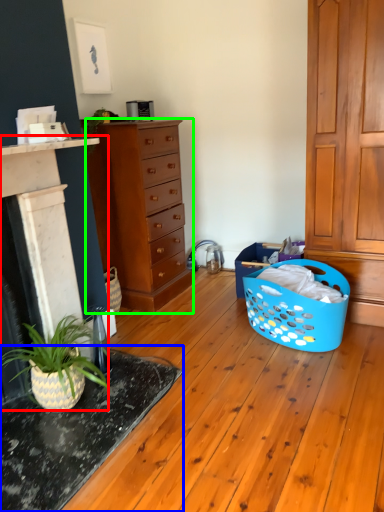
Question: Estimate the real-world distances between objects in this image. Which object is farther from fireplace (highlighted by a red box), table (highlighted by a blue box) or chest of drawers (highlighted by a green box)?

Choices:
 (A) table
 (B) chest of drawers

Answer: (B)